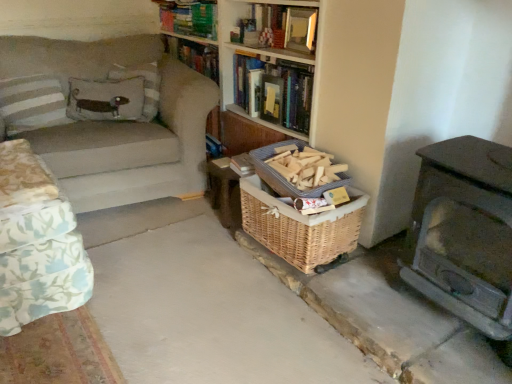
Question: Is brown textured basket at lower right located within woven brown basket at center, arranged as the 1th basket when viewed from the top?

Choices:
 (A) no
 (B) yes

Answer: (A)

Question: From a real-world perspective, is woven brown basket at center, arranged as the 1th basket when viewed from the top, on top of brown textured basket at lower right?

Choices:
 (A) no
 (B) yes

Answer: (B)

Question: Are woven brown basket at center, arranged as the 1th basket when viewed from the top, and brown textured basket at lower right located far from each other?

Choices:
 (A) no
 (B) yes

Answer: (A)

Question: From the image's perspective, is woven brown basket at center, arranged as the 1th basket when viewed from the top, located beneath brown textured basket at lower right?

Choices:
 (A) yes
 (B) no

Answer: (B)

Question: Does woven brown basket at center, arranged as the 1th basket when viewed from the top, come behind brown textured basket at lower right?

Choices:
 (A) yes
 (B) no

Answer: (A)

Question: From the image's perspective, is velvet-like brown pillow at upper left, the 1th pillow in the right-to-left sequence, located above or below hardcover book at upper center, the 2th book in the bottom-to-top sequence?

Choices:
 (A) below
 (B) above

Answer: (A)

Question: In terms of height, does velvet-like brown pillow at upper left, placed as the third pillow when sorted from left to right, look taller or shorter compared to hardcover book at upper center, the 2th book in the bottom-to-top sequence?

Choices:
 (A) tall
 (B) short

Answer: (A)

Question: In terms of width, does velvet-like brown pillow at upper left, the 1th pillow in the right-to-left sequence, look wider or thinner when compared to hardcover book at upper center, the 2th book in the bottom-to-top sequence?

Choices:
 (A) wide
 (B) thin

Answer: (A)

Question: Relative to hardcover book at upper center, which is the 2th book in top-to-bottom order, is velvet-like brown pillow at upper left, the 1th pillow in the right-to-left sequence, in front or behind?

Choices:
 (A) behind
 (B) front

Answer: (A)

Question: Do you think hardcover book at upper center, the 2th book in the bottom-to-top sequence, is within velvet-like brown pillow at upper left, placed as the third pillow when sorted from left to right, or outside of it?

Choices:
 (A) outside
 (B) inside

Answer: (A)

Question: Is point (274, 29) positioned closer to the camera than point (156, 76)?

Choices:
 (A) closer
 (B) farther

Answer: (A)

Question: Considering their positions, is hardcover book at upper center, which is the 2th book in top-to-bottom order, located in front of or behind velvet-like brown pillow at upper left, the 1th pillow in the right-to-left sequence?

Choices:
 (A) front
 (B) behind

Answer: (A)

Question: Based on their positions, is hardcover book at upper center, which is the 2th book in top-to-bottom order, located to the left or right of velvet-like brown pillow at upper left, the 1th pillow in the right-to-left sequence?

Choices:
 (A) left
 (B) right

Answer: (B)

Question: From the image's perspective, relative to hardcover books at upper center, which is counted as the 1th book, starting from the top, is hardcover book at upper center, arranged as the third book when viewed from the top, above or below?

Choices:
 (A) above
 (B) below

Answer: (B)

Question: Is point coord(296,76) closer or farther from the camera than point coord(176,26)?

Choices:
 (A) closer
 (B) farther

Answer: (A)